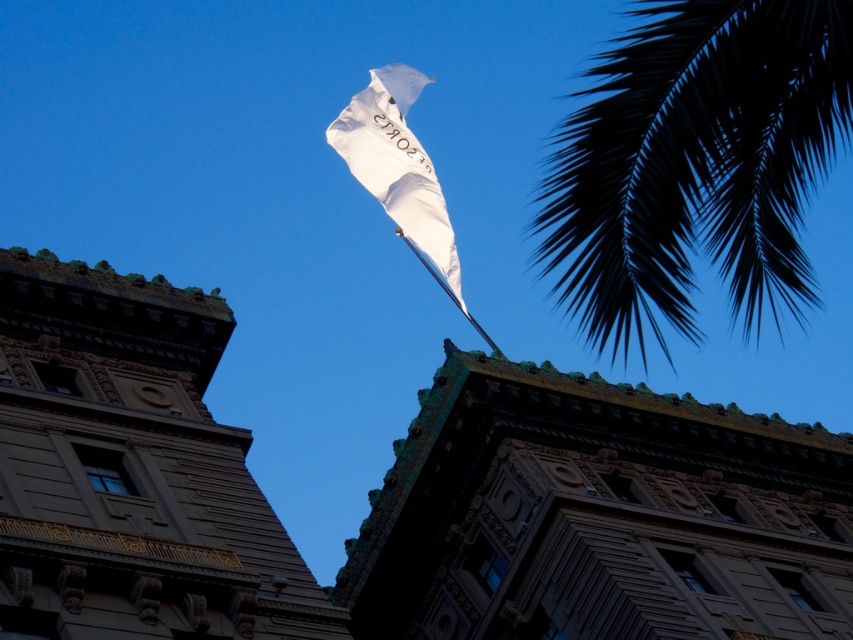
Is dark green leafy palm at upper right shorter than white fabric flag at center?

No, dark green leafy palm at upper right is not shorter than white fabric flag at center.

Between dark green leafy palm at upper right and white fabric flag at center, which one appears on the right side from the viewer's perspective?

From the viewer's perspective, dark green leafy palm at upper right appears more on the right side.

Which is in front, point (709, 104) or point (409, 241)?

Point (709, 104) is more forward.

The width and height of the screenshot is (853, 640). I want to click on dark green leafy palm at upper right, so click(x=695, y=164).

The width and height of the screenshot is (853, 640). What do you see at coordinates (131, 470) in the screenshot? I see `gold textured stone tower at center` at bounding box center [131, 470].

Is point (160, 481) closer to camera compared to point (469, 321)?

That is True.

Describe the element at coordinates (131, 470) in the screenshot. This screenshot has width=853, height=640. I see `gold textured stone tower at center` at that location.

Locate an element on the screen. gold textured stone tower at center is located at coordinates (131, 470).

Can you confirm if gold textured stone tower at center is thinner than dark green leafy palm at upper right?

Yes.

Identify the location of gold textured stone tower at center. The width and height of the screenshot is (853, 640). (131, 470).